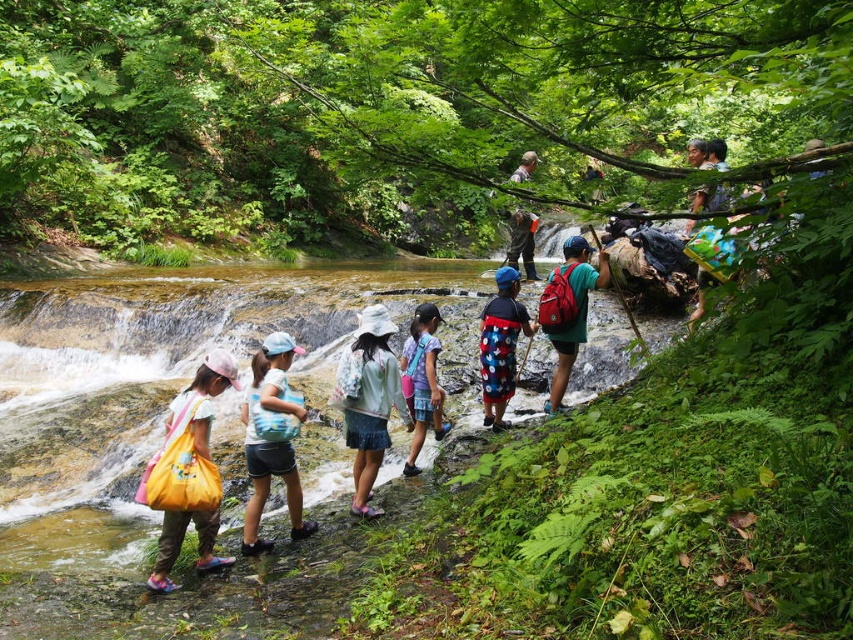
This screenshot has width=853, height=640. In order to click on yellow fabric bag at lower left in this screenshot , I will do `click(189, 472)`.

Is point (143, 484) farther from camera compared to point (335, 378)?

No, it is in front of (335, 378).

At what (x,y) coordinates should I click in order to perform the action: click on yellow fabric bag at lower left. Please return your answer as a coordinate pair (x, y). Looking at the image, I should click on (189, 472).

Between light blue fabric bag at center and polka dot fabric shirt at center, which one is positioned lower?

Positioned lower is light blue fabric bag at center.

Locate an element on the screen. light blue fabric bag at center is located at coordinates (271, 440).

Between matte green backpack at center and pastel blue fabric backpack at center, which one is positioned lower?

pastel blue fabric backpack at center is lower down.

Who is positioned more to the right, matte green backpack at center or pastel blue fabric backpack at center?

From the viewer's perspective, matte green backpack at center appears more on the right side.

Between point (558, 317) and point (413, 456), which one is positioned behind?

The point (558, 317) is more distant.

This screenshot has width=853, height=640. I want to click on matte green backpack at center, so click(567, 308).